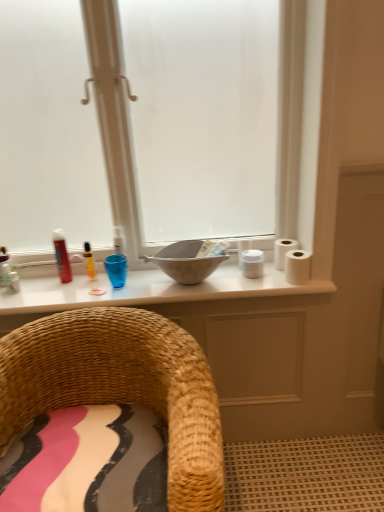
The height and width of the screenshot is (512, 384). Find the location of `vacant area located to the right-hand side of matte red can at left, acting as the 2th toiletry starting from the right`. vacant area located to the right-hand side of matte red can at left, acting as the 2th toiletry starting from the right is located at coordinates (99, 282).